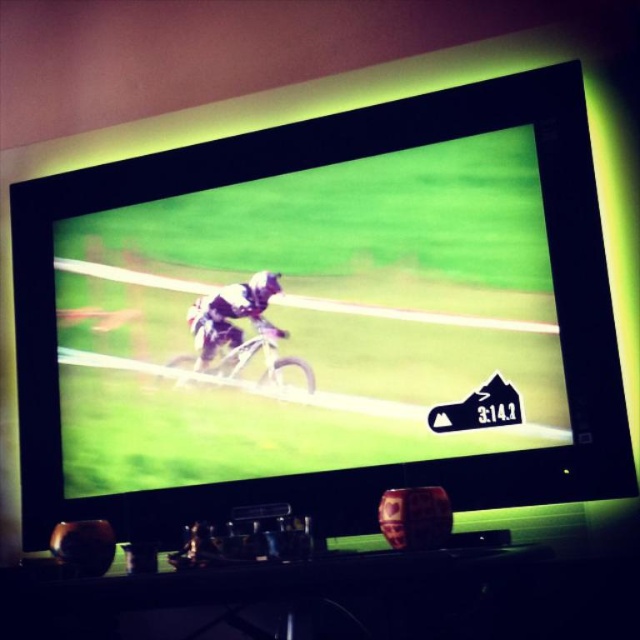
Question: Can you confirm if matte white bicycle at center is positioned to the right of metallic silver dirt bike at center?

Choices:
 (A) no
 (B) yes

Answer: (B)

Question: Does matte white bicycle at center come in front of white matte cyclist at center?

Choices:
 (A) no
 (B) yes

Answer: (B)

Question: Is white matte cyclist at center above metallic silver dirt bike at center?

Choices:
 (A) yes
 (B) no

Answer: (A)

Question: Which of the following is the farthest from the observer?

Choices:
 (A) (260, 294)
 (B) (529, 285)
 (C) (179, 358)

Answer: (C)

Question: Which object is the farthest from the metallic silver dirt bike at center?

Choices:
 (A) white matte cyclist at center
 (B) matte white bicycle at center

Answer: (B)

Question: Which is nearer to the matte white bicycle at center?

Choices:
 (A) white matte cyclist at center
 (B) metallic silver dirt bike at center

Answer: (B)